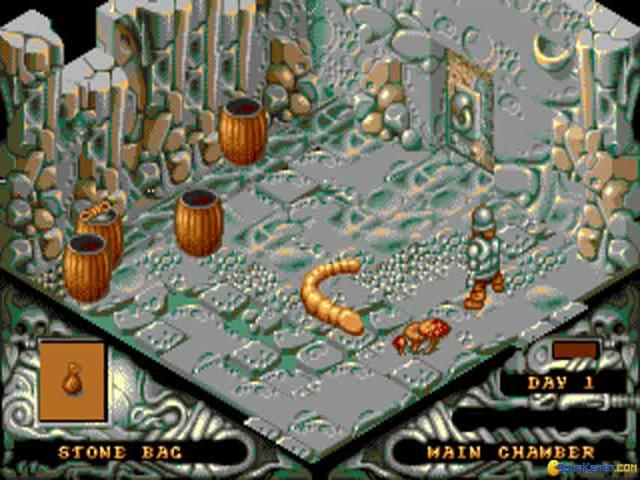
Find the location of a particular element. The image size is (640, 480). handle is located at coordinates (467, 126).